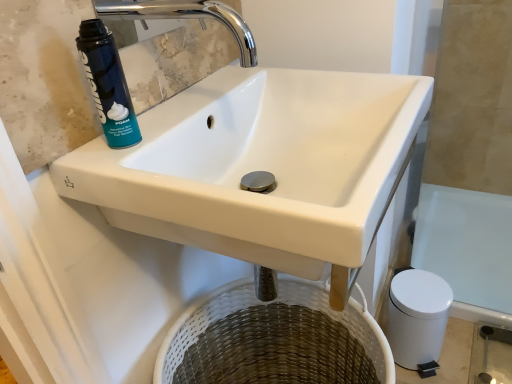
You are a GUI agent. You are given a task and a screenshot of the screen. Output one action in this format:
    pyautogui.click(x=<x>, y=<y>)
    Task: Click on the blue matte shaving cream can at upper left
    The width and height of the screenshot is (512, 384).
    Given the screenshot: What is the action you would take?
    pyautogui.click(x=108, y=84)

Measure the distance between white ceramic sink at upper center and camera.

white ceramic sink at upper center is 42.20 centimeters from camera.

What do you see at coordinates (262, 167) in the screenshot?
I see `white ceramic sink at upper center` at bounding box center [262, 167].

The width and height of the screenshot is (512, 384). In order to click on chrome metallic faucet at upper center in this screenshot , I will do `click(183, 18)`.

From the image's perspective, would you say white ceramic sink at upper center is shown under chrome metallic faucet at upper center?

Yes, from the image's perspective, white ceramic sink at upper center is below chrome metallic faucet at upper center.

Which is closer to the camera, (139, 202) or (100, 12)?

Point (139, 202) appears to be closer to the viewer than point (100, 12).

Would you say chrome metallic faucet at upper center is part of white ceramic sink at upper center's contents?

Actually, chrome metallic faucet at upper center is outside white ceramic sink at upper center.

Would you say blue matte shaving cream can at upper left is inside or outside white ceramic sink at upper center?

blue matte shaving cream can at upper left is outside white ceramic sink at upper center.

Who is shorter, blue matte shaving cream can at upper left or white ceramic sink at upper center?

Standing shorter between the two is blue matte shaving cream can at upper left.

Can you tell me how much blue matte shaving cream can at upper left and white ceramic sink at upper center differ in facing direction?

The facing directions of blue matte shaving cream can at upper left and white ceramic sink at upper center are 0.037 degrees apart.

From a real-world perspective, is blue matte shaving cream can at upper left below woven white basket at lower center?

No, from a real-world perspective, blue matte shaving cream can at upper left is not below woven white basket at lower center.

Is blue matte shaving cream can at upper left further to the viewer compared to woven white basket at lower center?

No, it is in front of woven white basket at lower center.

Would you consider blue matte shaving cream can at upper left to be distant from woven white basket at lower center?

That's not correct — blue matte shaving cream can at upper left is a little close to woven white basket at lower center.

Could you tell me if woven white basket at lower center is facing chrome metallic faucet at upper center?

No.

Considering the relative sizes of woven white basket at lower center and chrome metallic faucet at upper center in the image provided, is woven white basket at lower center taller than chrome metallic faucet at upper center?

Yes.

Is point (293, 326) closer or farther from the camera than point (244, 60)?

Point (293, 326) is farther from the camera than point (244, 60).

Can woven white basket at lower center be found inside chrome metallic faucet at upper center?

No, chrome metallic faucet at upper center does not contain woven white basket at lower center.

Can you confirm if chrome metallic faucet at upper center is taller than woven white basket at lower center?

Incorrect, the height of chrome metallic faucet at upper center is not larger of that of woven white basket at lower center.

Who is smaller, chrome metallic faucet at upper center or woven white basket at lower center?

chrome metallic faucet at upper center is smaller.

From the image's perspective, is chrome metallic faucet at upper center beneath woven white basket at lower center?

No.

The width and height of the screenshot is (512, 384). I want to click on cleaning product on the left of woven white basket at lower center, so click(x=108, y=84).

Is point (213, 310) closer to camera compared to point (126, 141)?

No, it is behind (126, 141).

Considering the sizes of objects blue matte shaving cream can at upper left and chrome metallic faucet at upper center in the image provided, who is smaller, blue matte shaving cream can at upper left or chrome metallic faucet at upper center?

blue matte shaving cream can at upper left is smaller.

Does blue matte shaving cream can at upper left come in front of chrome metallic faucet at upper center?

No, it is not.

In terms of height, does blue matte shaving cream can at upper left look taller or shorter compared to chrome metallic faucet at upper center?

blue matte shaving cream can at upper left is taller than chrome metallic faucet at upper center.

Is blue matte shaving cream can at upper left positioned beyond the bounds of chrome metallic faucet at upper center?

blue matte shaving cream can at upper left lies outside chrome metallic faucet at upper center's area.

Locate an element on the screen. The width and height of the screenshot is (512, 384). tap above the white ceramic sink at upper center (from a real-world perspective) is located at coordinates (183, 18).

The height and width of the screenshot is (384, 512). I want to click on sink lying in front of the blue matte shaving cream can at upper left, so click(262, 167).

Consider the image. Looking at the image, which one is located further to chrome metallic faucet at upper center, blue matte shaving cream can at upper left or woven white basket at lower center?

The object further to chrome metallic faucet at upper center is woven white basket at lower center.

Which object lies further to the anchor point white ceramic sink at upper center, blue matte shaving cream can at upper left or chrome metallic faucet at upper center?

Among the two, chrome metallic faucet at upper center is located further to white ceramic sink at upper center.

Considering their positions, is woven white basket at lower center positioned closer to white ceramic sink at upper center than chrome metallic faucet at upper center?

Among the two, chrome metallic faucet at upper center is located nearer to white ceramic sink at upper center.

Looking at the image, which one is located further to blue matte shaving cream can at upper left, woven white basket at lower center or white ceramic sink at upper center?

woven white basket at lower center.

Which object lies nearer to the anchor point white ceramic sink at upper center, blue matte shaving cream can at upper left or woven white basket at lower center?

The object closer to white ceramic sink at upper center is blue matte shaving cream can at upper left.

Estimate the real-world distances between objects in this image. Which object is closer to chrome metallic faucet at upper center, white ceramic sink at upper center or blue matte shaving cream can at upper left?

blue matte shaving cream can at upper left is closer to chrome metallic faucet at upper center.

Estimate the real-world distances between objects in this image. Which object is further from woven white basket at lower center, blue matte shaving cream can at upper left or white ceramic sink at upper center?

Based on the image, blue matte shaving cream can at upper left appears to be further to woven white basket at lower center.

Estimate the real-world distances between objects in this image. Which object is closer to woven white basket at lower center, blue matte shaving cream can at upper left or chrome metallic faucet at upper center?

blue matte shaving cream can at upper left is closer to woven white basket at lower center.

Image resolution: width=512 pixels, height=384 pixels. Find the location of `cleaning product between chrome metallic faucet at upper center and white ceramic sink at upper center from top to bottom`. cleaning product between chrome metallic faucet at upper center and white ceramic sink at upper center from top to bottom is located at coordinates (108, 84).

You are a GUI agent. You are given a task and a screenshot of the screen. Output one action in this format:
    pyautogui.click(x=<x>, y=<y>)
    Task: Click on the cleaning product between chrome metallic faucet at upper center and woven white basket at lower center from top to bottom
    This screenshot has height=384, width=512.
    Given the screenshot: What is the action you would take?
    pyautogui.click(x=108, y=84)

You are a GUI agent. You are given a task and a screenshot of the screen. Output one action in this format:
    pyautogui.click(x=<x>, y=<y>)
    Task: Click on the sink between chrome metallic faucet at upper center and woven white basket at lower center vertically
    The height and width of the screenshot is (384, 512).
    Given the screenshot: What is the action you would take?
    pyautogui.click(x=262, y=167)

This screenshot has height=384, width=512. In order to click on sink between blue matte shaving cream can at upper left and woven white basket at lower center in the vertical direction in this screenshot , I will do `click(262, 167)`.